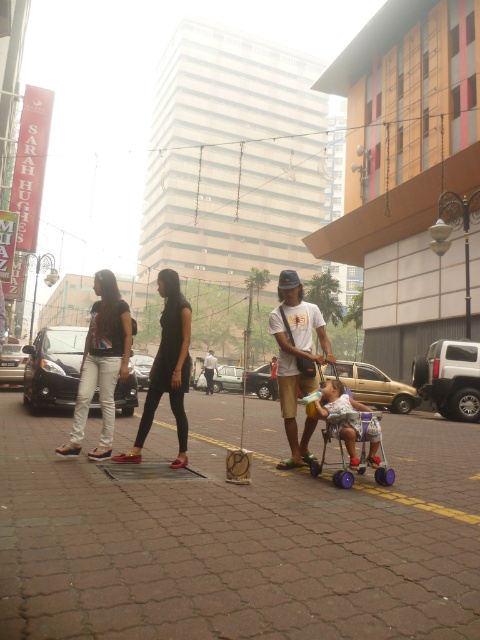
What do you see at coordinates (236, 545) in the screenshot? I see `brown brick pavement at center` at bounding box center [236, 545].

Between brown brick pavement at center and light brown leather jacket at center, which one has more height?

light brown leather jacket at center

Between point (180, 554) and point (204, 368), which one is positioned behind?

Point (204, 368)

At what (x,y) coordinates should I click in order to perform the action: click on brown brick pavement at center. Please return your answer as a coordinate pair (x, y). The height and width of the screenshot is (640, 480). Looking at the image, I should click on (236, 545).

Between brown brick pavement at center and matte black shirt at center, which one is positioned lower?

brown brick pavement at center is lower down.

Is brown brick pavement at center closer to camera compared to matte black shirt at center?

Yes, brown brick pavement at center is closer to the viewer.

What do you see at coordinates (236, 545) in the screenshot?
I see `brown brick pavement at center` at bounding box center [236, 545].

This screenshot has width=480, height=640. I want to click on brown brick pavement at center, so click(x=236, y=545).

Does matte white t-shirt at center have a greater width compared to black matte dress at center?

No.

Does matte white t-shirt at center have a lesser height compared to black matte dress at center?

Indeed, matte white t-shirt at center has a lesser height compared to black matte dress at center.

Is point (297, 316) behind point (155, 403)?

Yes, point (297, 316) is behind point (155, 403).

Image resolution: width=480 pixels, height=640 pixels. Find the location of `matte white t-shirt at center`. matte white t-shirt at center is located at coordinates (297, 358).